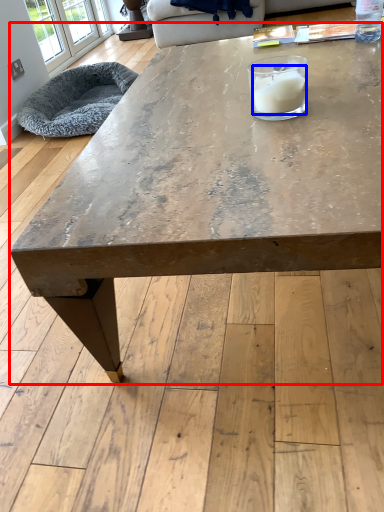
Question: Which of the following is the farthest to the observer, coffee table (highlighted by a red box) or candle (highlighted by a blue box)?

Choices:
 (A) coffee table
 (B) candle

Answer: (B)